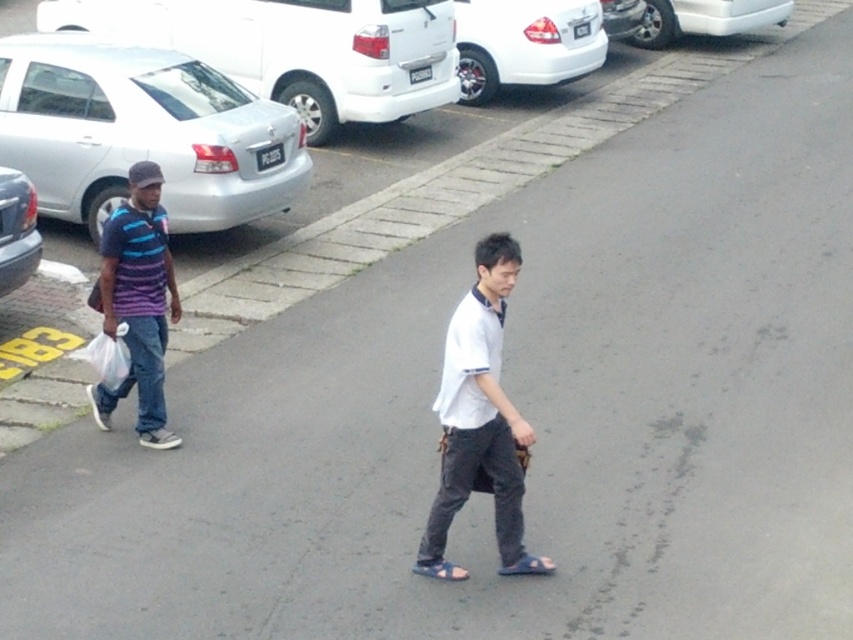
You are a fashion designer observing two people on a road. You notice the white matte shirt at center and the blue fabric sandal at lower center. Which item has a greater width?

The white matte shirt at center has a greater width than the blue fabric sandal at lower center.

You are standing at the point marked by the coordinates point (525, 44). What object is exactly at this location?

The white glossy sedan at upper center is exactly at point (525, 44).

You are a delivery person who needs to place a package on the sidewalk between the white glossy sedan at upper center and the white plastic bag at left. The package is 30 feet long. Can you fit the package between them without overlapping either object?

The distance between the white glossy sedan at upper center and the white plastic bag at left is 32.29 feet. Since the package is 30 feet long, there is enough space to fit it between them without overlapping either object.